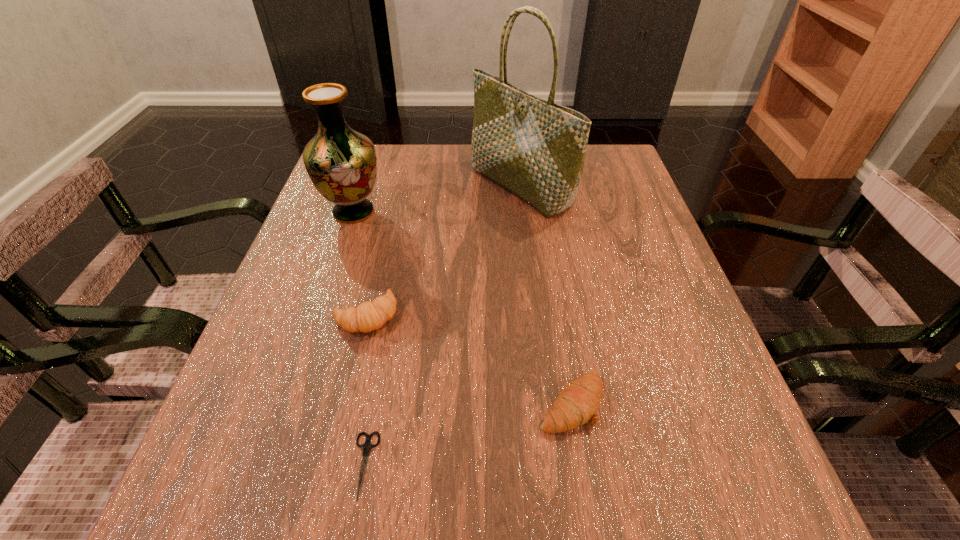
You are a GUI agent. You are given a task and a screenshot of the screen. Output one action in this format:
    pyautogui.click(x=<x>, y=<y>)
    Task: Click on the tallest object
    Image resolution: width=960 pixels, height=540 pixels.
    Given the screenshot: What is the action you would take?
    pyautogui.click(x=534, y=148)

At what (x,y) coordinates should I click in order to perform the action: click on the fourth shortest object. Please return your answer as a coordinate pair (x, y). Looking at the image, I should click on (341, 162).

Where is `the third nearest object`? The image size is (960, 540). the third nearest object is located at coordinates (368, 316).

Find the location of a particular element. This screenshot has height=540, width=960. the farther crescent roll is located at coordinates (368, 316).

The image size is (960, 540). Identify the location of the nearer crescent roll. (577, 404).

The image size is (960, 540). I want to click on the second shortest object, so click(577, 404).

Where is `shears`? The height and width of the screenshot is (540, 960). shears is located at coordinates (366, 447).

I want to click on free spot located on the left of the tallest object, so click(x=383, y=187).

The height and width of the screenshot is (540, 960). Find the location of `free space located on the back of the second tallest object`. free space located on the back of the second tallest object is located at coordinates (372, 158).

Locate an element on the screen. free location located 0.280m on the right of the third nearest object is located at coordinates (551, 315).